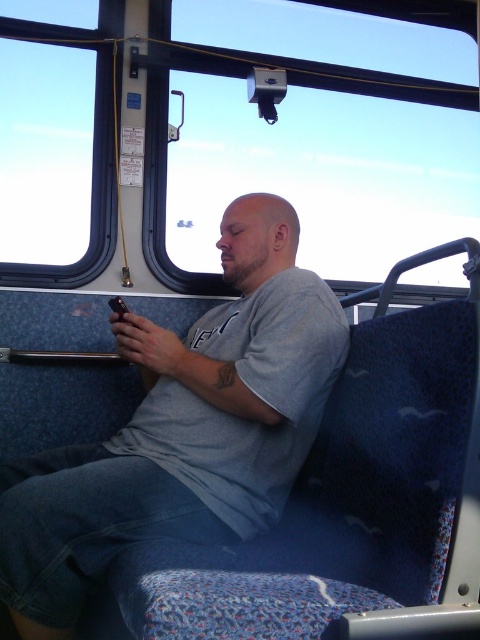
Where is `transparent glass window at center`? The image size is (480, 640). transparent glass window at center is located at coordinates (322, 173).

The width and height of the screenshot is (480, 640). What do you see at coordinates (322, 173) in the screenshot?
I see `transparent glass window at center` at bounding box center [322, 173].

What are the coordinates of `transparent glass window at center` in the screenshot? It's located at (322, 173).